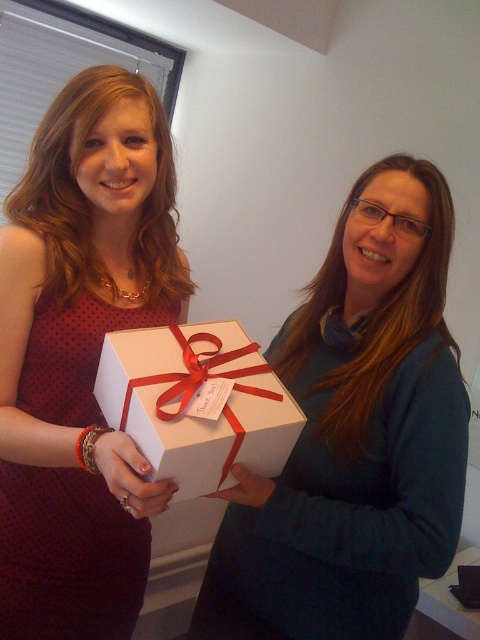
Can you confirm if matte black dress at center is shorter than white matte gift box at center?

Incorrect, matte black dress at center's height does not fall short of white matte gift box at center's.

Based on the photo, who is positioned more to the left, matte black dress at center or white matte gift box at center?

From the viewer's perspective, matte black dress at center appears more on the left side.

This screenshot has height=640, width=480. Describe the element at coordinates (82, 356) in the screenshot. I see `matte black dress at center` at that location.

You are a GUI agent. You are given a task and a screenshot of the screen. Output one action in this format:
    pyautogui.click(x=<x>, y=<y>)
    Task: Click on the matte black dress at center
    The image size is (480, 640).
    Given the screenshot: What is the action you would take?
    pyautogui.click(x=82, y=356)

Can you confirm if matte white sweater at center is positioned below matte black dress at center?

Correct, matte white sweater at center is located below matte black dress at center.

Measure the distance between point [328,312] and camera.

The distance of point [328,312] from camera is 1.24 meters.

I want to click on matte white sweater at center, so click(355, 435).

Can you confirm if matte white sweater at center is taller than white matte gift box at center?

Correct, matte white sweater at center is much taller as white matte gift box at center.

Between point (291, 369) and point (263, 397), which one is positioned behind?

The point (291, 369) is behind.

Find the location of a particular element. The image size is (480, 640). matte white sweater at center is located at coordinates (355, 435).